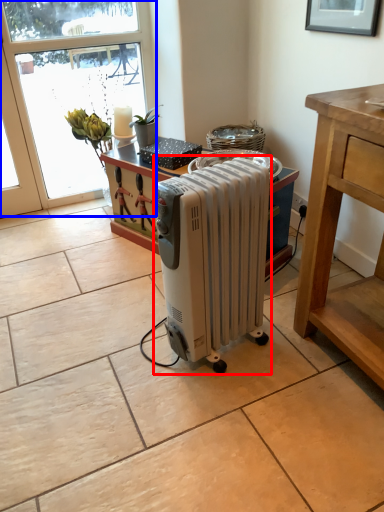
Question: Which object is closer to the camera taking this photo, home appliance (highlighted by a red box) or window (highlighted by a blue box)?

Choices:
 (A) home appliance
 (B) window

Answer: (A)